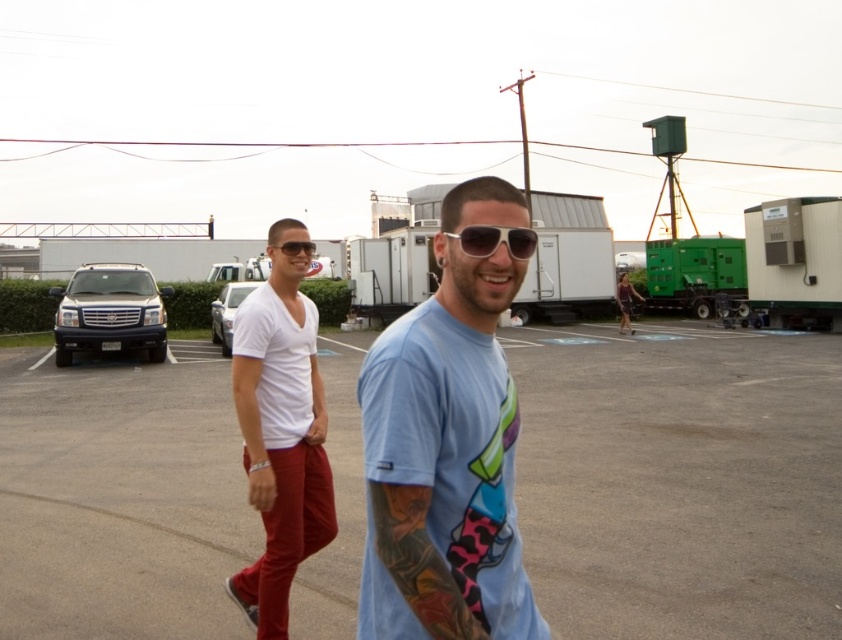
You are standing in the parking lot and want to describe the clothing items you see. Which clothing item is positioned to the left of the other between the white matte shirt at center and the sunglasses at center?

The white matte shirt at center is positioned to the left of the sunglasses at center.

You are a photographer trying to capture a wide shot of the two people in the scene. The shiny black suv at left is blocking part of the frame. Can you estimate if the sunglasses at center can be fully visible in the photo if you move the suv to the side?

The shiny black suv at left is wider than the sunglasses at center, so moving the suv to the side would allow the sunglasses at center to be fully visible as it is narrower.

You are a photographer standing in the parking lot. You want to take a photo of the shiny black suv at left and the sunglasses at center. Which object is positioned higher in the frame?

The shiny black suv at left is positioned higher in the frame than the sunglasses at center.